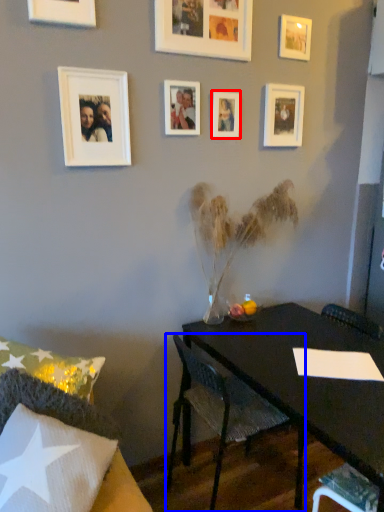
Question: Which object appears closest to the camera in this image, picture frame (highlighted by a red box) or chair (highlighted by a blue box)?

Choices:
 (A) picture frame
 (B) chair

Answer: (B)